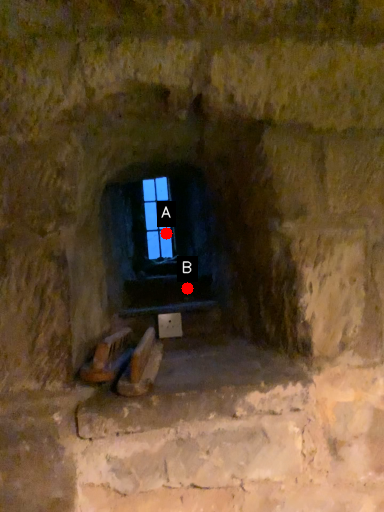
Question: Two points are circled on the image, labeled by A and B beside each circle. Which point is closer to the camera taking this photo?

Choices:
 (A) A is closer
 (B) B is closer

Answer: (B)